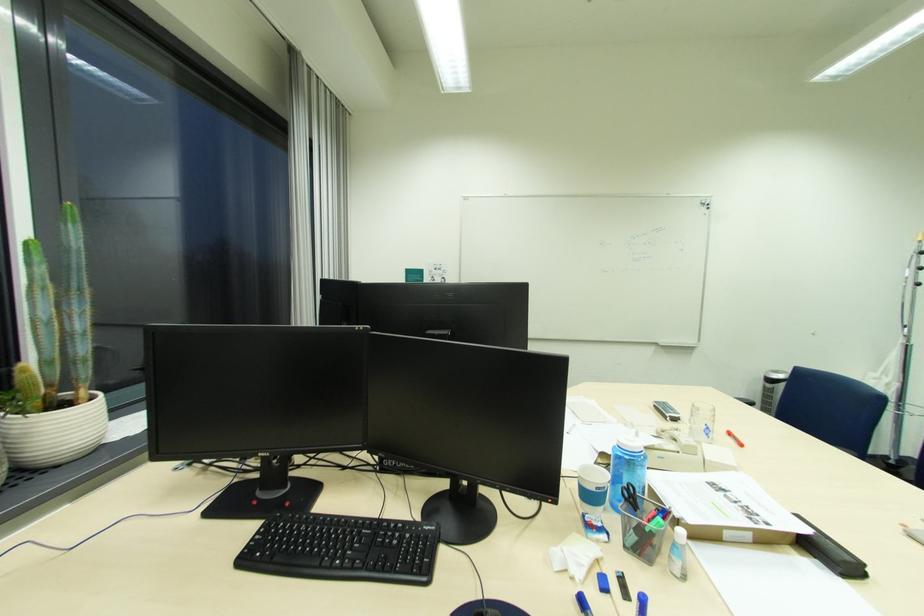
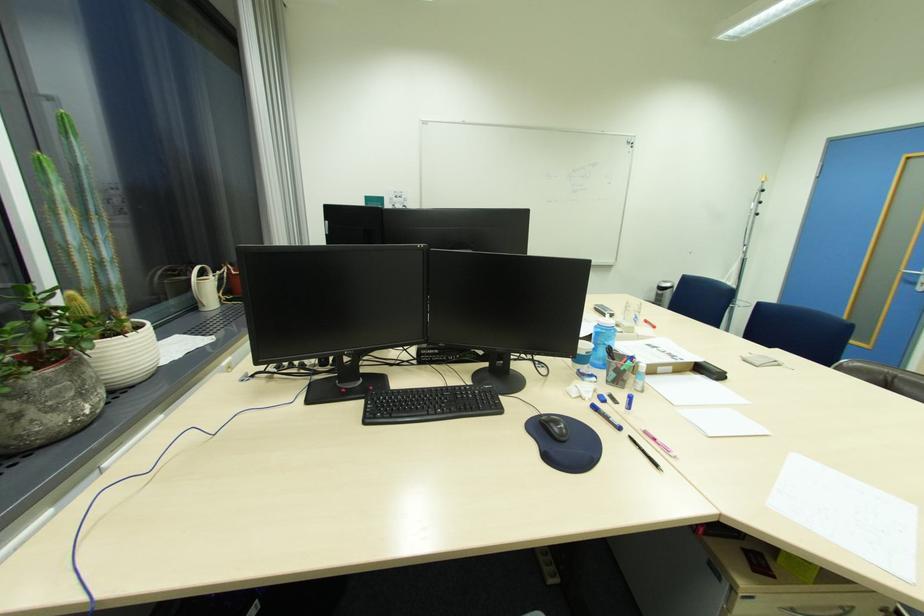
Question: The first image is from the beginning of the video and the second image is from the end. How did the camera likely rotate when shooting the video?

Choices:
 (A) Left
 (B) Right
 (C) Up
 (D) Down

Answer: (B)